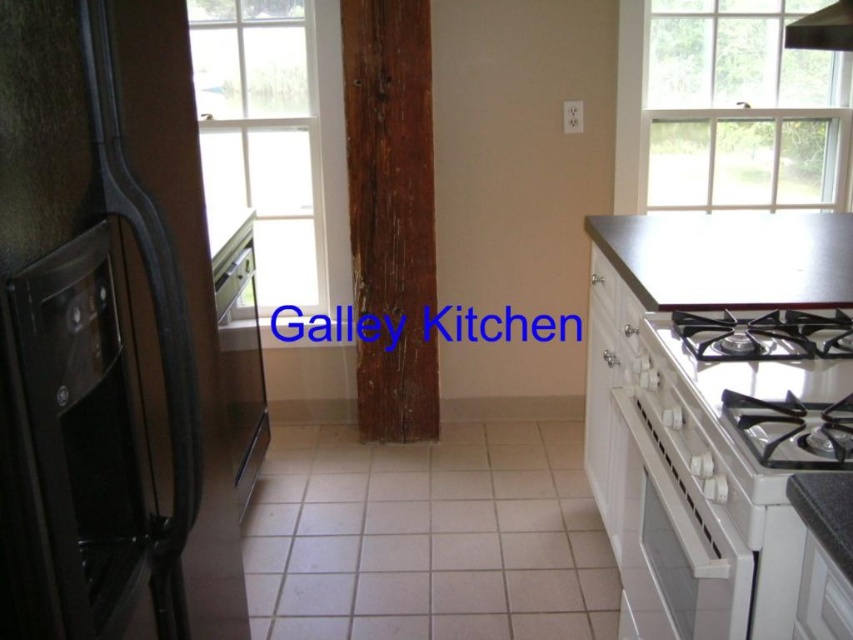
Question: Can you confirm if white glossy gas stove at right is smaller than satin silver refrigerator at left?

Choices:
 (A) no
 (B) yes

Answer: (B)

Question: Can you confirm if clear glass window at upper right is thinner than satin silver refrigerator at left?

Choices:
 (A) yes
 (B) no

Answer: (B)

Question: Which object appears closest to the camera in this image?

Choices:
 (A) smooth gray countertop at right
 (B) white glossy oven at right
 (C) satin silver refrigerator at left

Answer: (A)

Question: Which point is farther to the camera?

Choices:
 (A) (813, 500)
 (B) (769, 422)
 (C) (315, 163)

Answer: (C)

Question: Which point is closer to the camera?

Choices:
 (A) clear glass window at upper center
 (B) metallic gray countertop at upper right
 (C) white glossy gas stove at right
 (D) satin silver refrigerator at left

Answer: (C)

Question: Does clear glass window at upper right appear under smooth gray countertop at right?

Choices:
 (A) no
 (B) yes

Answer: (A)